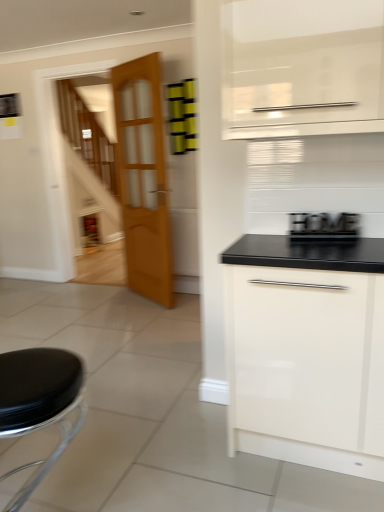
Question: Is black wood sign at right positioned with its back to black leather stool at lower left?

Choices:
 (A) yes
 (B) no

Answer: (B)

Question: Considering the relative positions of black wood sign at right and black leather stool at lower left in the image provided, is black wood sign at right to the right of black leather stool at lower left from the viewer's perspective?

Choices:
 (A) no
 (B) yes

Answer: (B)

Question: Considering the relative sizes of black wood sign at right and black leather stool at lower left in the image provided, is black wood sign at right bigger than black leather stool at lower left?

Choices:
 (A) no
 (B) yes

Answer: (A)

Question: Are black wood sign at right and black leather stool at lower left far apart?

Choices:
 (A) yes
 (B) no

Answer: (A)

Question: From the image's perspective, is black wood sign at right above black leather stool at lower left?

Choices:
 (A) yes
 (B) no

Answer: (A)

Question: Is white glossy cabinet at lower right to the left or to the right of black leather stool at lower left in the image?

Choices:
 (A) left
 (B) right

Answer: (B)

Question: Choose the correct answer: Is white glossy cabinet at lower right inside black leather stool at lower left or outside it?

Choices:
 (A) outside
 (B) inside

Answer: (A)

Question: Is point (228, 345) positioned closer to the camera than point (36, 351)?

Choices:
 (A) farther
 (B) closer

Answer: (A)

Question: From the image's perspective, is white glossy cabinet at lower right positioned above or below black leather stool at lower left?

Choices:
 (A) below
 (B) above

Answer: (B)

Question: From the image's perspective, is white glossy cabinet at lower right above or below black wood sign at right?

Choices:
 (A) below
 (B) above

Answer: (A)

Question: Is point (248, 443) positioned closer to the camera than point (329, 223)?

Choices:
 (A) closer
 (B) farther

Answer: (B)

Question: From a real-world perspective, relative to black wood sign at right, is white glossy cabinet at lower right vertically above or below?

Choices:
 (A) above
 (B) below

Answer: (B)

Question: Considering their positions, is white glossy cabinet at lower right located in front of or behind black wood sign at right?

Choices:
 (A) behind
 (B) front

Answer: (B)

Question: Choose the correct answer: Is black leather stool at lower left inside black wood sign at right or outside it?

Choices:
 (A) inside
 (B) outside

Answer: (B)

Question: In terms of width, does black leather stool at lower left look wider or thinner when compared to black wood sign at right?

Choices:
 (A) wide
 (B) thin

Answer: (A)